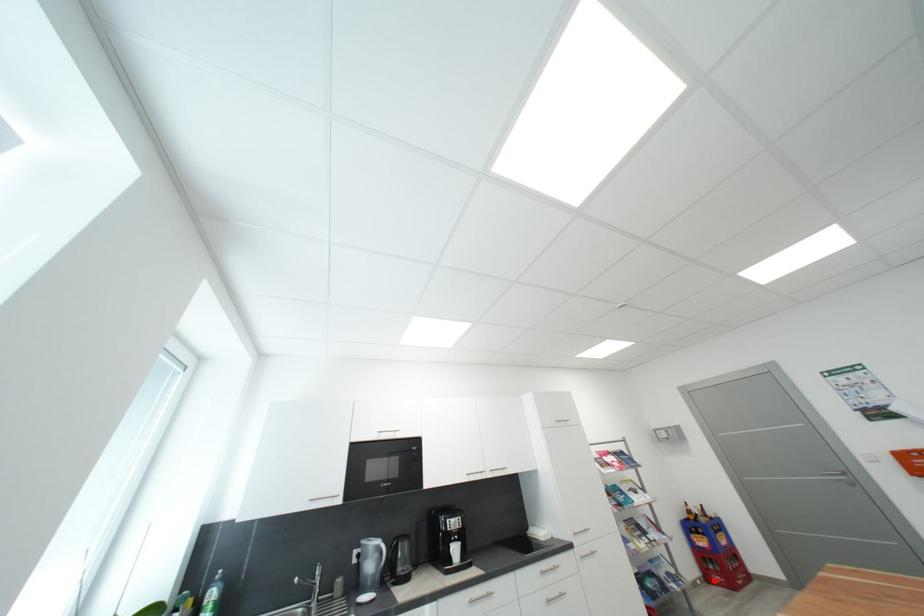
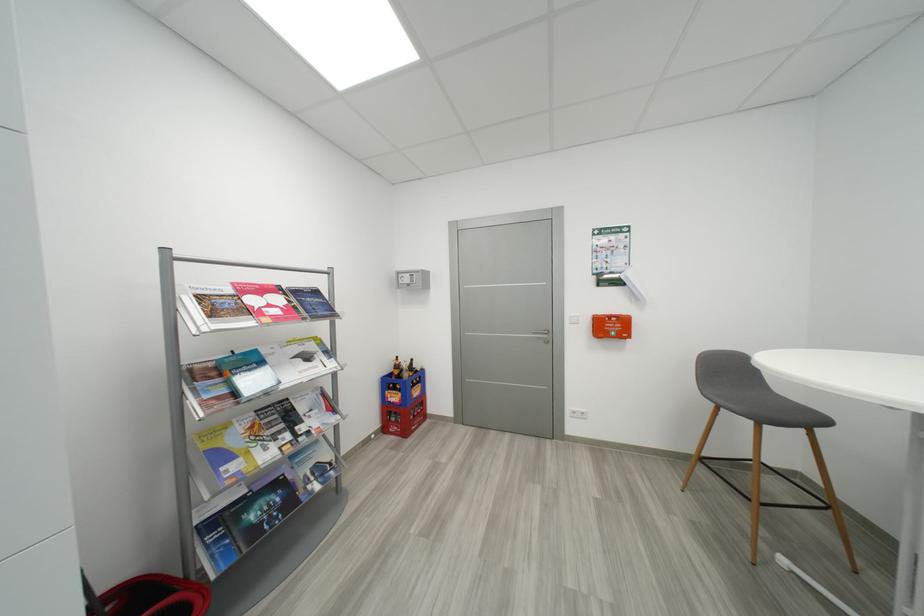
Question: I am providing you with two images of the same scene from different viewpoints. Given a red point in image1, look at the same physical point in image2. Is it:

Choices:
 (A) Closer to the viewpoint
 (B) Farther from the viewpoint

Answer: (A)